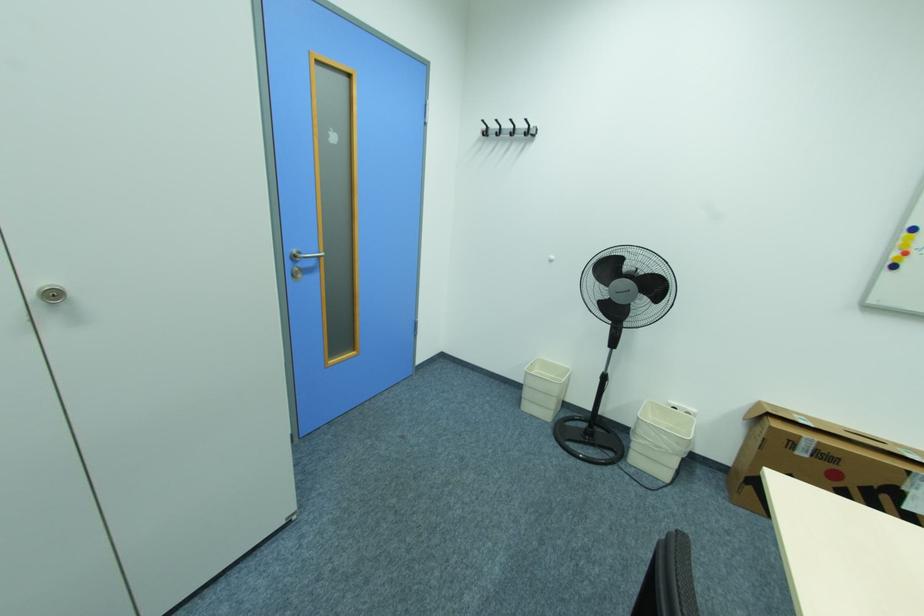
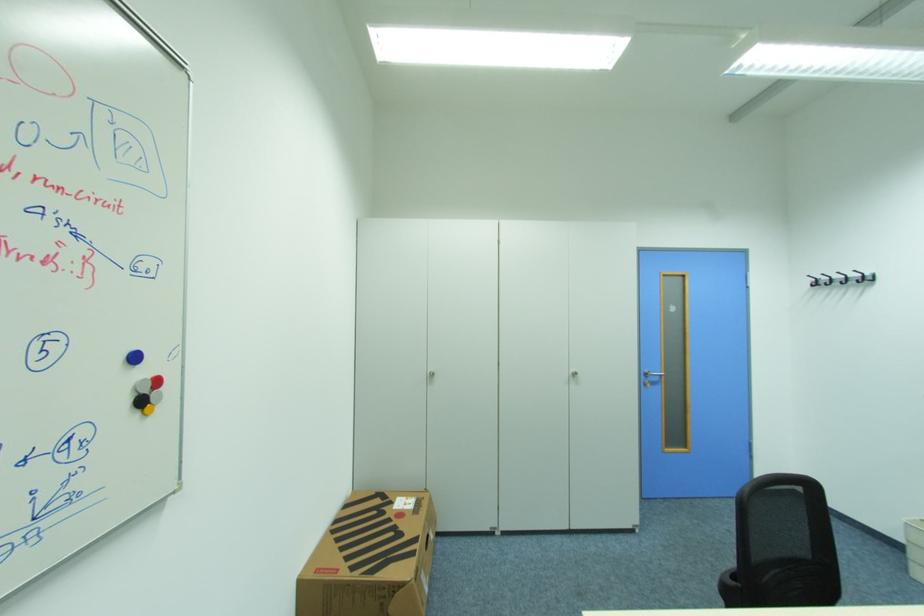
In the second image, find the point that corresponds to [300,252] in the first image.

(651, 371)